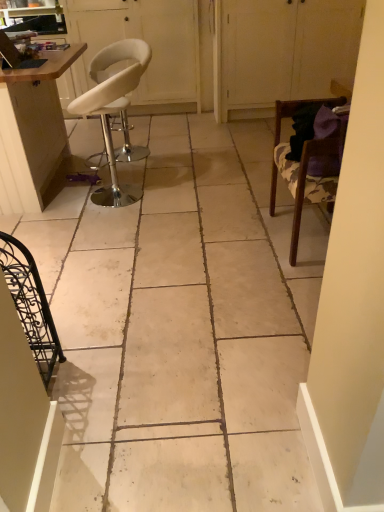
Identify the location of free point behind black wrought iron chair at lower left, the 3th chair from the right. The image size is (384, 512). (77, 337).